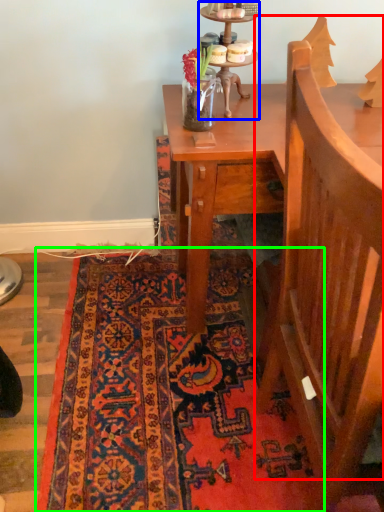
Question: Based on their relative distances, which object is nearer to armchair (highlighted by a red box)? Choose from candle holder (highlighted by a blue box) and mat (highlighted by a green box).

Choices:
 (A) candle holder
 (B) mat

Answer: (B)